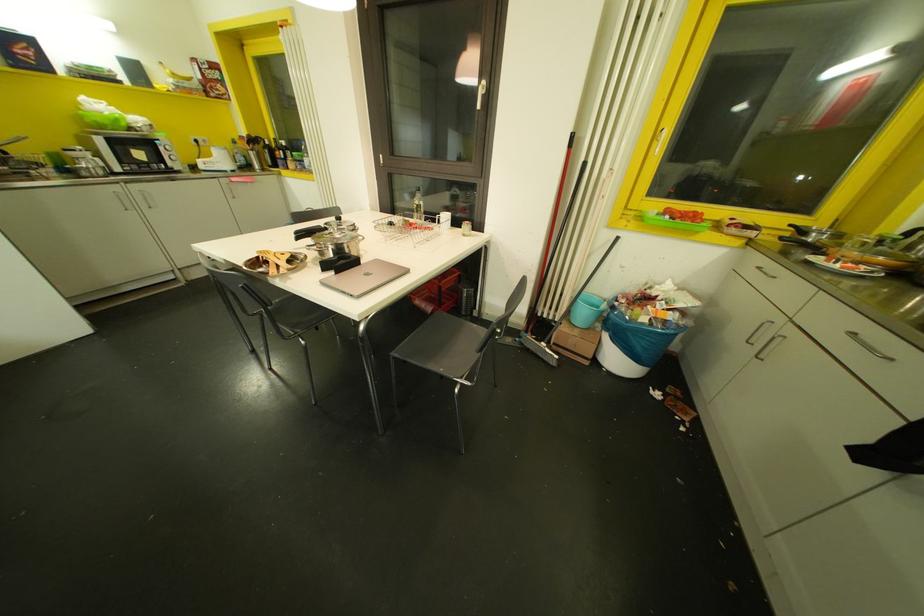
Find where to turn the brown window handle. Please return your answer as a coordinate pair (x, y).

(484, 87)